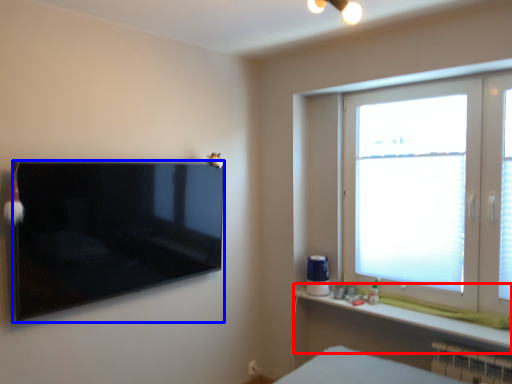
Question: Which object appears farthest to the camera in this image, window sill (highlighted by a red box) or television (highlighted by a blue box)?

Choices:
 (A) window sill
 (B) television

Answer: (A)